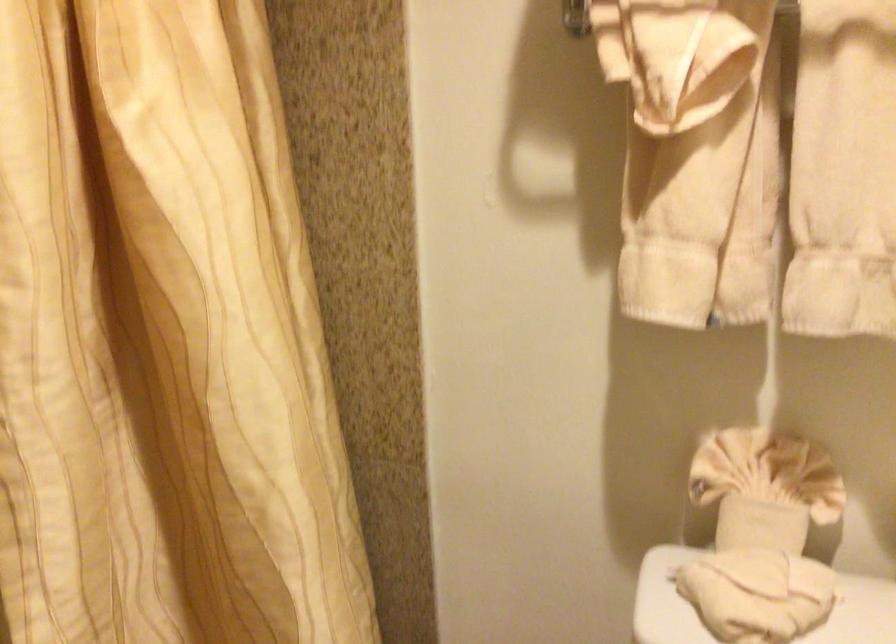
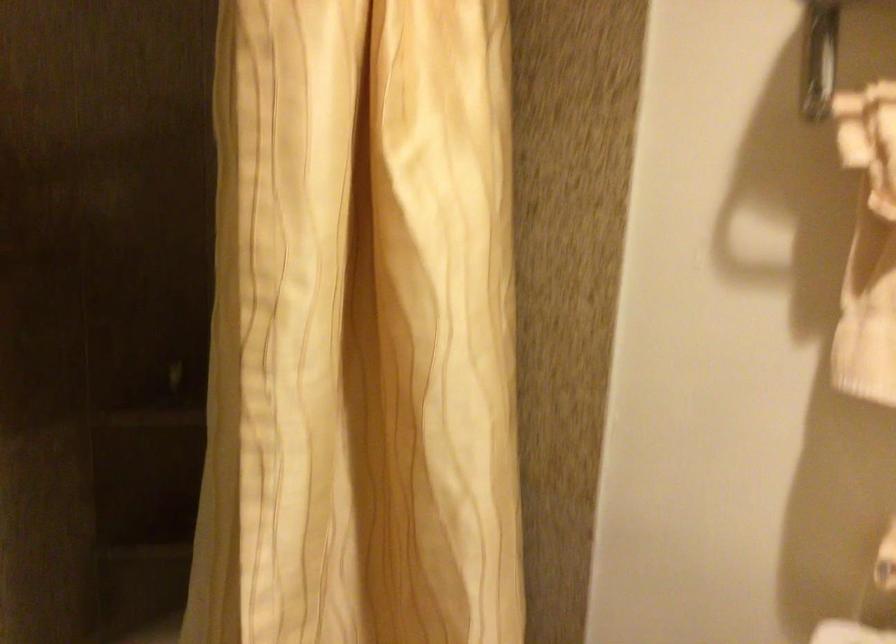
Which direction would the cameraman need to move to produce the second image?

The cameraman moved toward left, backward.